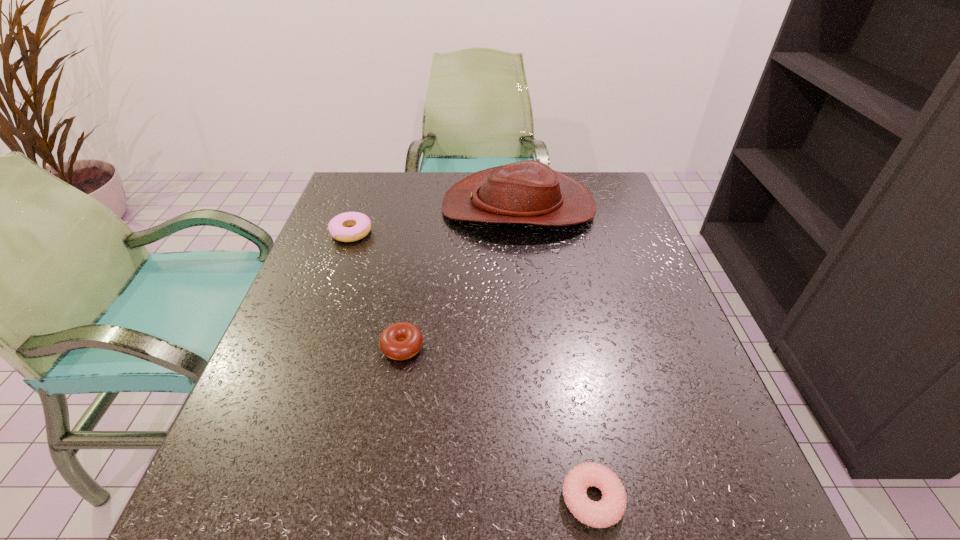
At what (x,y) coordinates should I click in order to perform the action: click on vacant space that satisfies the following two spatial constraints: 1. on the front-facing side of the cowboy hat; 2. on the right side of the nearest doughnut. Please return your answer as a coordinate pair (x, y). This screenshot has height=540, width=960. Looking at the image, I should click on (552, 499).

Locate an element on the screen. The width and height of the screenshot is (960, 540). vacant region that satisfies the following two spatial constraints: 1. on the front-facing side of the cowboy hat; 2. on the front side of the leftmost object is located at coordinates (521, 233).